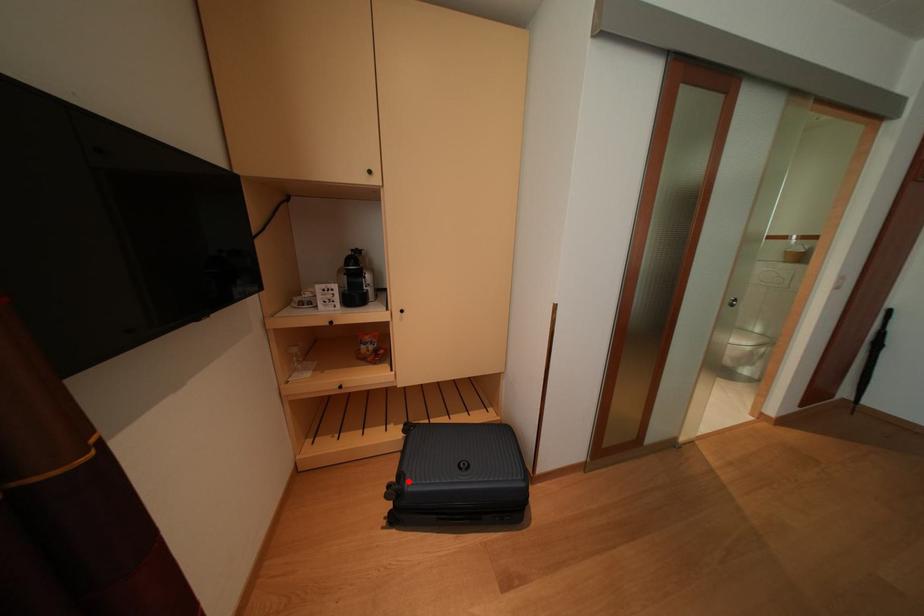
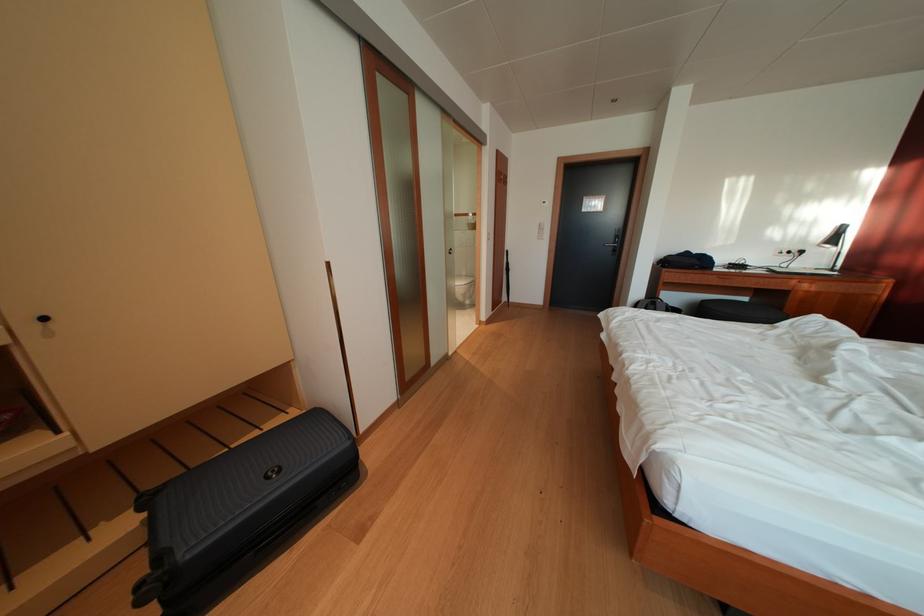
In the second image, find the point that corresponds to the highlighted location in the first image.

(167, 562)